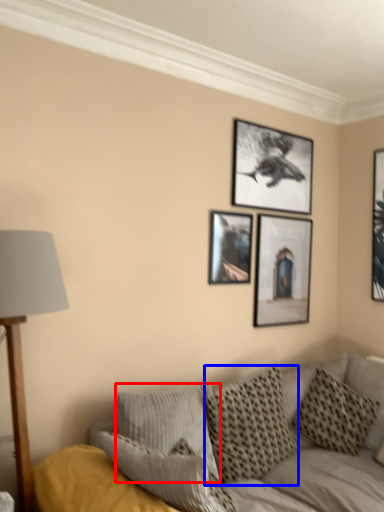
Question: Among these objects, which one is farthest to the camera, pillow (highlighted by a red box) or pillow (highlighted by a blue box)?

Choices:
 (A) pillow
 (B) pillow

Answer: (B)